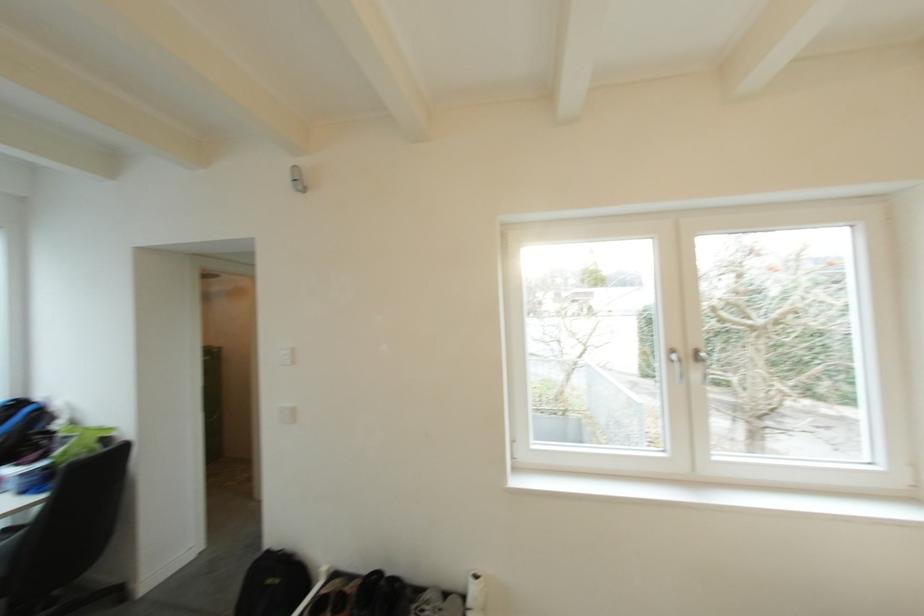
Where would you sit the black chair sitting surface? Please return your answer as a coordinate pair (x, y).

(8, 544)